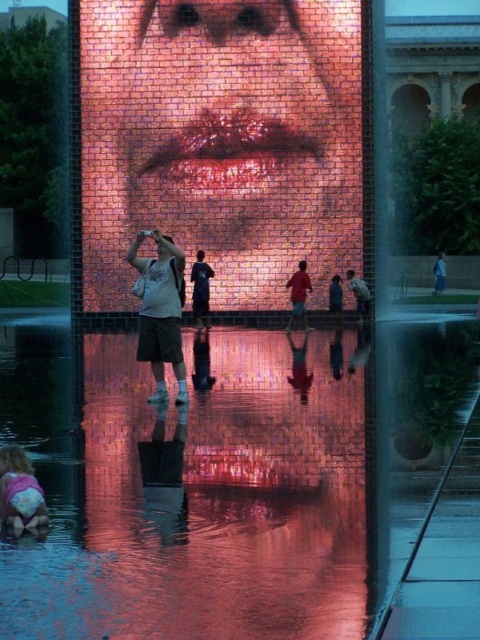
Question: Which point is closer to the camera?

Choices:
 (A) glossy reflective water at center
 (B) matte white t-shirt at center

Answer: (A)

Question: Is glossy reflective water at center in front of pink fabric at lower left?

Choices:
 (A) yes
 (B) no

Answer: (A)

Question: Which point is closer to the camera?

Choices:
 (A) (197, 605)
 (B) (0, 461)
 (C) (304, 314)

Answer: (A)

Question: Can you confirm if glossy reflective water at center is smaller than dark blue jeans at center?

Choices:
 (A) no
 (B) yes

Answer: (A)

Question: Which object is the farthest from the matte red shirt at center?

Choices:
 (A) pink fabric at lower left
 (B) matte white t-shirt at center
 (C) matte gray shirt at center

Answer: (A)

Question: Does matte white t-shirt at center have a greater width compared to dark blue jeans at center?

Choices:
 (A) no
 (B) yes

Answer: (B)